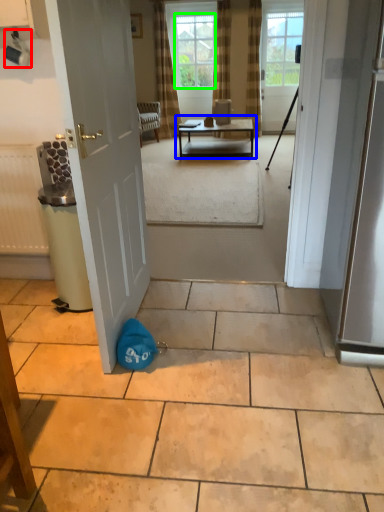
Question: Which is farther away from coffee cup (highlighted by a red box)? table (highlighted by a blue box) or window screen (highlighted by a green box)?

Choices:
 (A) table
 (B) window screen

Answer: (B)